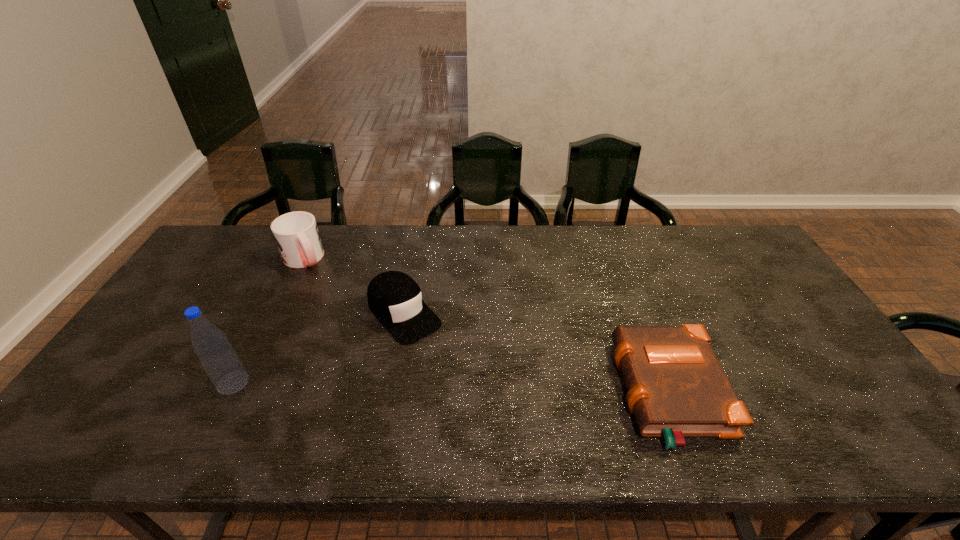
At what (x,y) coordinates should I click in order to perform the action: click on free spot located on the spine side of the shortest object. Please return your answer as a coordinate pair (x, y). This screenshot has height=540, width=960. Looking at the image, I should click on (563, 393).

Image resolution: width=960 pixels, height=540 pixels. Identify the location of vacant space located 0.190m on the side of the third shortest object with the handle. (333, 306).

Locate an element on the screen. Image resolution: width=960 pixels, height=540 pixels. vacant area situated on the side of the third shortest object with the handle is located at coordinates (321, 288).

This screenshot has width=960, height=540. I want to click on vacant space located on the side of the third shortest object with the handle, so click(322, 290).

Locate an element on the screen. vacant position located on the front-facing side of the third object from left to right is located at coordinates (490, 409).

Where is `vacant region located on the front-facing side of the third object from left to right`? vacant region located on the front-facing side of the third object from left to right is located at coordinates (440, 354).

In order to click on vacant space located on the front-facing side of the third object from left to right in this screenshot , I will do `click(487, 406)`.

This screenshot has height=540, width=960. What are the coordinates of `object at the far edge` in the screenshot? It's located at (x=296, y=234).

I want to click on water bottle that is at the near edge, so (220, 361).

The width and height of the screenshot is (960, 540). I want to click on Bible present at the near edge, so click(676, 386).